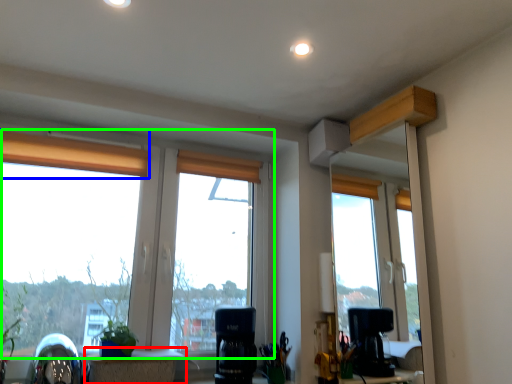
Question: Which object is the farthest from table (highlighted by a red box)? Choose among these: curtain (highlighted by a blue box) or window (highlighted by a green box).

Choices:
 (A) curtain
 (B) window

Answer: (A)